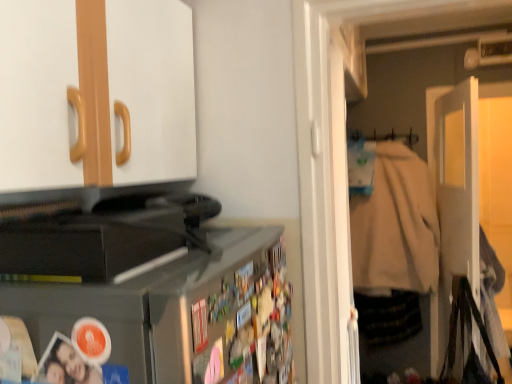
This screenshot has height=384, width=512. What are the coordinates of `free space above white fabric hanger at upper right (from a real-world perspective)` in the screenshot? It's located at (389, 130).